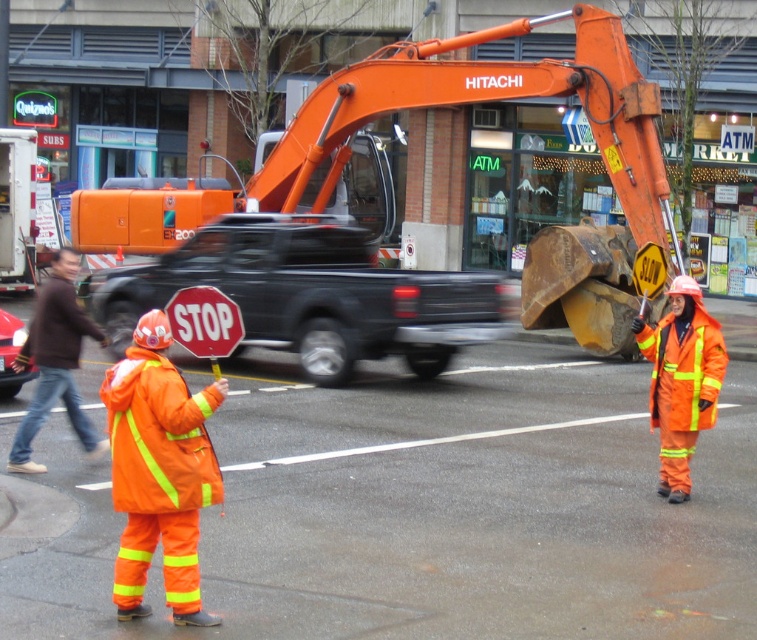
Can you confirm if orange metallic excavator at center is wider than orange reflective jacket at right?

Yes, orange metallic excavator at center is wider than orange reflective jacket at right.

Is point (488, 92) more distant than point (690, 280)?

Yes.

Does point (675, 246) lie behind point (695, 346)?

That is True.

The width and height of the screenshot is (757, 640). Identify the location of orange metallic excavator at center. (488, 100).

Which is behind, point (678, 369) or point (0, 324)?

Point (0, 324)

Can you confirm if orange reflective jacket at right is taller than shiny red car at left?

Correct, orange reflective jacket at right is much taller as shiny red car at left.

Between point (670, 492) and point (11, 394), which one is positioned behind?

Positioned behind is point (11, 394).

Image resolution: width=757 pixels, height=640 pixels. Find the location of `orange reflective jacket at right`. orange reflective jacket at right is located at coordinates (681, 380).

Between point (363, 234) and point (217, 314), which one is positioned behind?

Point (363, 234)

Which is behind, point (410, 346) or point (167, 305)?

Point (410, 346)

This screenshot has width=757, height=640. What are the coordinates of `black matte truck at center` in the screenshot? It's located at (312, 296).